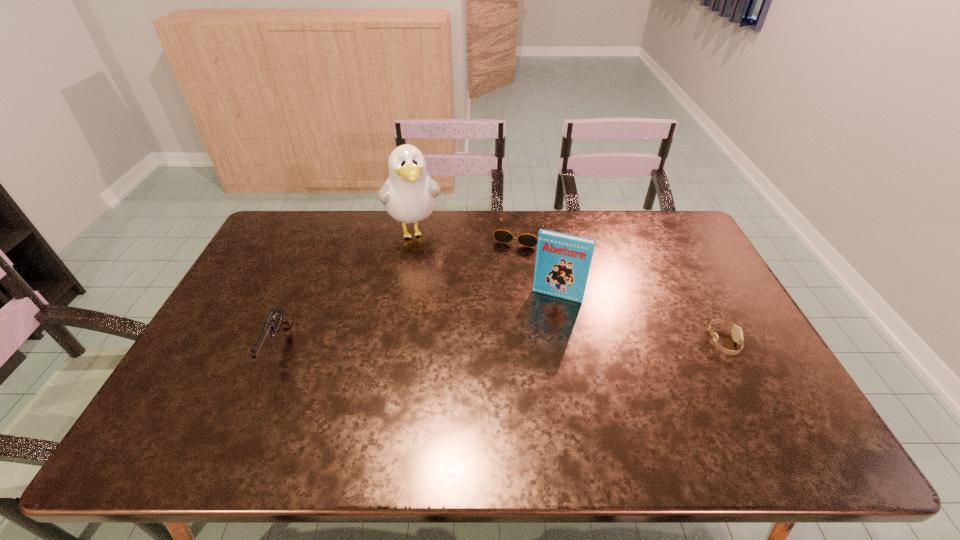
Identify the location of vacant space located 0.080m on the front-facing side of the sunglasses. Image resolution: width=960 pixels, height=540 pixels. (508, 262).

At what (x,y) coordinates should I click in order to perform the action: click on vacant position located on the front-facing side of the sunglasses. Please return your answer as a coordinate pair (x, y). Looking at the image, I should click on (508, 262).

Image resolution: width=960 pixels, height=540 pixels. I want to click on free space located 0.370m on the front-facing side of the sunglasses, so click(x=487, y=326).

Where is `free space located on the beak of the gull`? free space located on the beak of the gull is located at coordinates (424, 280).

What are the coordinates of `vacant area situated on the beak of the gull` in the screenshot? It's located at (420, 264).

I want to click on free space located 0.200m on the beak of the gull, so click(427, 292).

You are a GUI agent. You are given a task and a screenshot of the screen. Output one action in this format:
    pyautogui.click(x=<x>, y=<y>)
    Task: Click on the vacant space situated 0.130m on the front cover of the third farthest object
    The height and width of the screenshot is (540, 960).
    Given the screenshot: What is the action you would take?
    pyautogui.click(x=540, y=334)

You are a GUI agent. You are given a task and a screenshot of the screen. Output one action in this format:
    pyautogui.click(x=<x>, y=<y>)
    Task: Click on the vacant space situated on the front cover of the third farthest object
    
    Given the screenshot: What is the action you would take?
    pyautogui.click(x=516, y=405)

Find the location of a particular element. This screenshot has height=540, width=960. free space located on the front cover of the third farthest object is located at coordinates (518, 399).

Locate an element on the screen. sunglasses that is at the far edge is located at coordinates (503, 236).